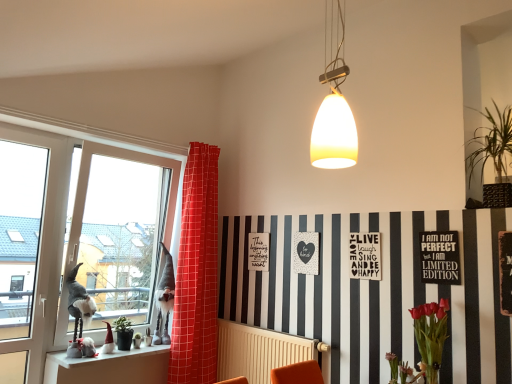
Question: Should I look upward or downward to see beige radiator at lower center?

Choices:
 (A) down
 (B) up

Answer: (A)

Question: Is black wood sign at right, arranged as the second bulletin board when viewed from the back, smaller than black matte signboard at upper center, placed as the 2th postcard when sorted from back to front?

Choices:
 (A) yes
 (B) no

Answer: (B)

Question: Does black wood sign at right, the 2th bulletin board positioned from the left, have a lesser width compared to black matte signboard at upper center, placed as the 2th postcard when sorted from back to front?

Choices:
 (A) no
 (B) yes

Answer: (A)

Question: Is black wood sign at right, the 1th bulletin board from the right, located outside black matte signboard at upper center, arranged as the 2th postcard when viewed from the left?

Choices:
 (A) no
 (B) yes

Answer: (B)

Question: Is black wood sign at right, the 1th bulletin board from the right, surrounding black matte signboard at upper center, positioned as the first postcard in right-to-left order?

Choices:
 (A) yes
 (B) no

Answer: (B)

Question: Can you confirm if black wood sign at right, the 1th bulletin board from the right, is taller than black matte signboard at upper center, arranged as the 2th postcard when viewed from the left?

Choices:
 (A) yes
 (B) no

Answer: (A)

Question: Is black wood sign at right, the 2th bulletin board positioned from the left, shorter than black matte signboard at upper center, which appears as the 1th postcard when viewed from the front?

Choices:
 (A) no
 (B) yes

Answer: (A)

Question: Considering the relative sizes of transparent glass window at left and green leafy plant at upper right, the 2th plant in the bottom-to-top sequence, in the image provided, is transparent glass window at left bigger than green leafy plant at upper right, the 2th plant in the bottom-to-top sequence,?

Choices:
 (A) yes
 (B) no

Answer: (A)

Question: Considering the relative sizes of transparent glass window at left and green leafy plant at upper right, the 2th plant in the bottom-to-top sequence, in the image provided, is transparent glass window at left thinner than green leafy plant at upper right, the 2th plant in the bottom-to-top sequence,?

Choices:
 (A) no
 (B) yes

Answer: (B)

Question: Is transparent glass window at left with green leafy plant at upper right, arranged as the 1th plant when viewed from the front?

Choices:
 (A) yes
 (B) no

Answer: (B)

Question: Does transparent glass window at left contain green leafy plant at upper right, which is the 1th plant in right-to-left order?

Choices:
 (A) no
 (B) yes

Answer: (A)

Question: From a real-world perspective, is transparent glass window at left located beneath green leafy plant at upper right, the 2th plant in the bottom-to-top sequence?

Choices:
 (A) no
 (B) yes

Answer: (B)

Question: Is transparent glass window at left not near green leafy plant at upper right, the first plant viewed from the top?

Choices:
 (A) no
 (B) yes

Answer: (B)

Question: Are transparent glass window at left and green matte plant at lower left, which ranks as the first plant in bottom-to-top order, far apart?

Choices:
 (A) no
 (B) yes

Answer: (A)